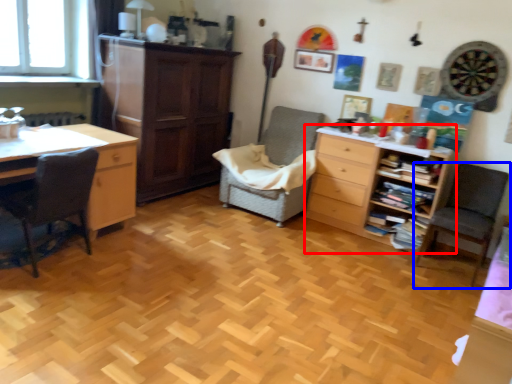
Question: Which point is closer to the camera, chest of drawers (highlighted by a red box) or chair (highlighted by a blue box)?

Choices:
 (A) chest of drawers
 (B) chair

Answer: (B)